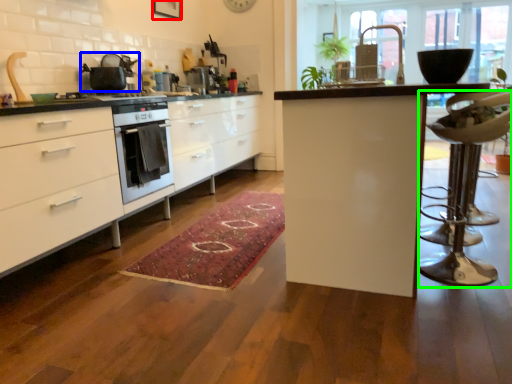
Question: Estimate the real-world distances between objects in this image. Which object is farther from picture frame (highlighted by a red box), kitchen appliance (highlighted by a blue box) or swivel chair (highlighted by a green box)?

Choices:
 (A) kitchen appliance
 (B) swivel chair

Answer: (B)